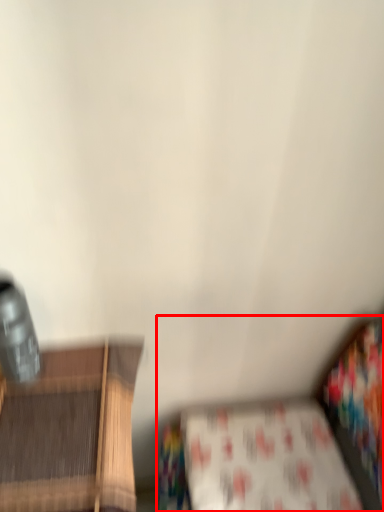
Question: Observing the image, what is the correct spatial positioning of studio couch (annotated by the red box) in reference to sheet?

Choices:
 (A) left
 (B) right

Answer: (A)